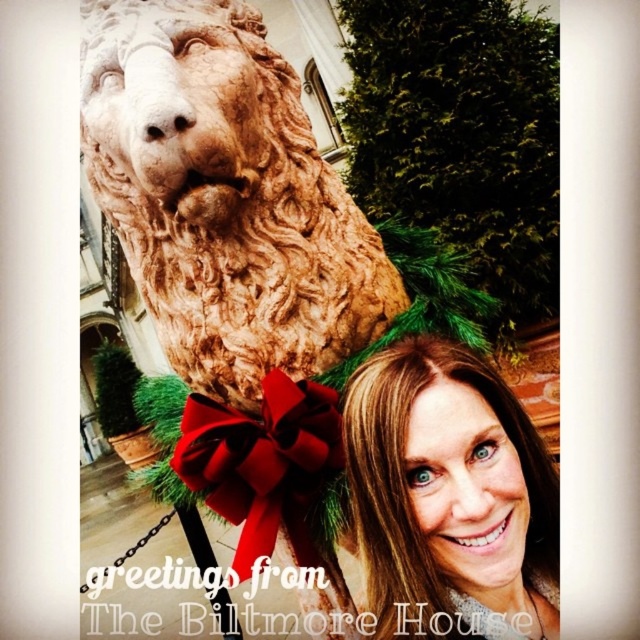
Is point (154, 35) less distant than point (504, 412)?

No, (154, 35) is behind (504, 412).

The width and height of the screenshot is (640, 640). Identify the location of brown stone lion at upper left. (225, 196).

The height and width of the screenshot is (640, 640). I want to click on brown stone lion at upper left, so click(x=225, y=196).

Which is below, blonde hair at center or red satin bow at center?

red satin bow at center

Which is above, blonde hair at center or red satin bow at center?

blonde hair at center

Is point (481, 465) closer to camera compared to point (296, 540)?

Yes, point (481, 465) is in front of point (296, 540).

In order to click on blonde hair at center in this screenshot , I will do `click(449, 493)`.

Can you confirm if brown stone lion at upper left is bigger than red satin bow at center?

Correct, brown stone lion at upper left is larger in size than red satin bow at center.

Is brown stone lion at upper left taller than red satin bow at center?

Yes.

Where is `brown stone lion at upper left`? brown stone lion at upper left is located at coordinates (225, 196).

At what (x,y) coordinates should I click in order to perform the action: click on brown stone lion at upper left. Please return your answer as a coordinate pair (x, y). This screenshot has width=640, height=640. Looking at the image, I should click on (225, 196).